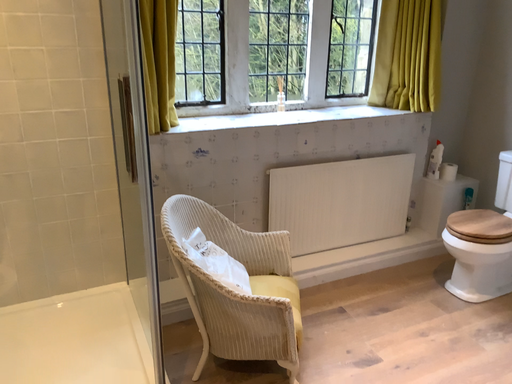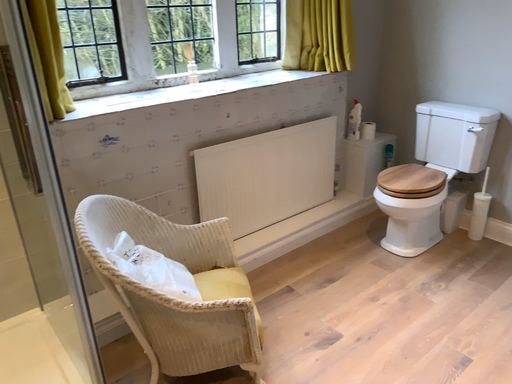
Question: Which way did the camera rotate in the video?

Choices:
 (A) rotated right
 (B) rotated left

Answer: (A)